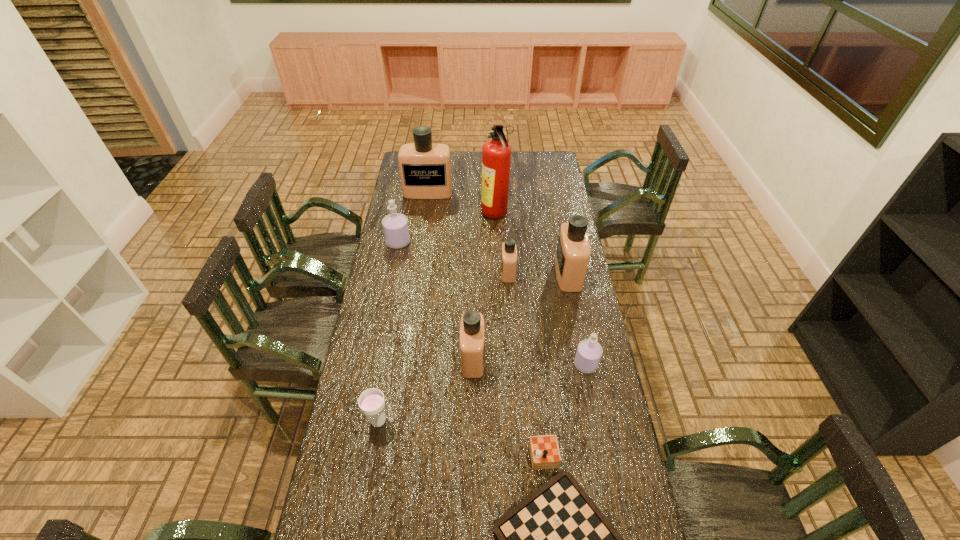
The image size is (960, 540). I want to click on cup present at the left edge, so click(372, 403).

Locate an element on the screen. The height and width of the screenshot is (540, 960). free space at the far edge is located at coordinates (522, 151).

In the image, there is a desktop. At what (x,y) coordinates should I click in order to perform the action: click on free space at the left edge. Please return your answer as a coordinate pair (x, y). Looking at the image, I should click on (353, 423).

The height and width of the screenshot is (540, 960). What are the coordinates of `free space at the right edge` in the screenshot? It's located at (550, 233).

Identify the location of empty space between the third perfume from right to left and the second biggest beige perfume. The height and width of the screenshot is (540, 960). (539, 273).

Image resolution: width=960 pixels, height=540 pixels. In order to click on blank region between the left purple perfume and the eighth tallest object in this screenshot , I will do `click(388, 332)`.

At what (x,y) coordinates should I click in order to perform the action: click on vacant area that lies between the farther purple perfume and the second nearest object. Please return your answer as a coordinate pair (x, y). Looking at the image, I should click on (388, 332).

The image size is (960, 540). I want to click on vacant region between the cup and the bigger purple perfume, so click(388, 332).

At what (x,y) coordinates should I click in order to perform the action: click on free space between the smaller purple perfume and the eighth farthest object. Please return your answer as a coordinate pair (x, y). The image size is (960, 540). Looking at the image, I should click on (482, 393).

The image size is (960, 540). In order to click on vacant area that lies between the third beige perfume from left to right and the farthest perfume in this screenshot , I will do `click(468, 232)`.